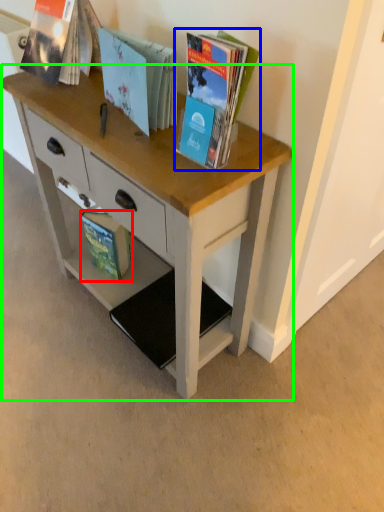
Question: Which is farther away from book (highlighted by a red box)? book (highlighted by a blue box) or desk (highlighted by a green box)?

Choices:
 (A) book
 (B) desk

Answer: (A)